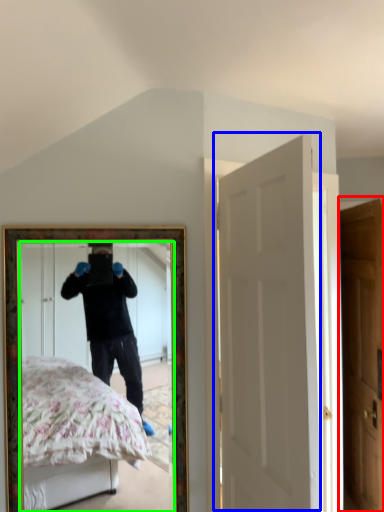
Question: Which object is positioned closest to door (highlighted by a red box)? Select from door (highlighted by a blue box) and mirror (highlighted by a green box).

Choices:
 (A) door
 (B) mirror

Answer: (A)